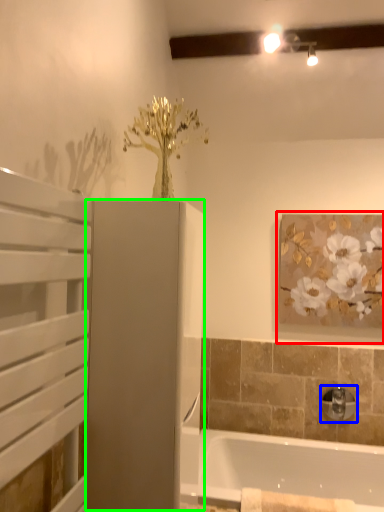
Question: Based on their relative distances, which object is nearer to picture frame (highlighted by a red box)? Choose from tap (highlighted by a blue box) and screen door (highlighted by a green box).

Choices:
 (A) tap
 (B) screen door

Answer: (A)